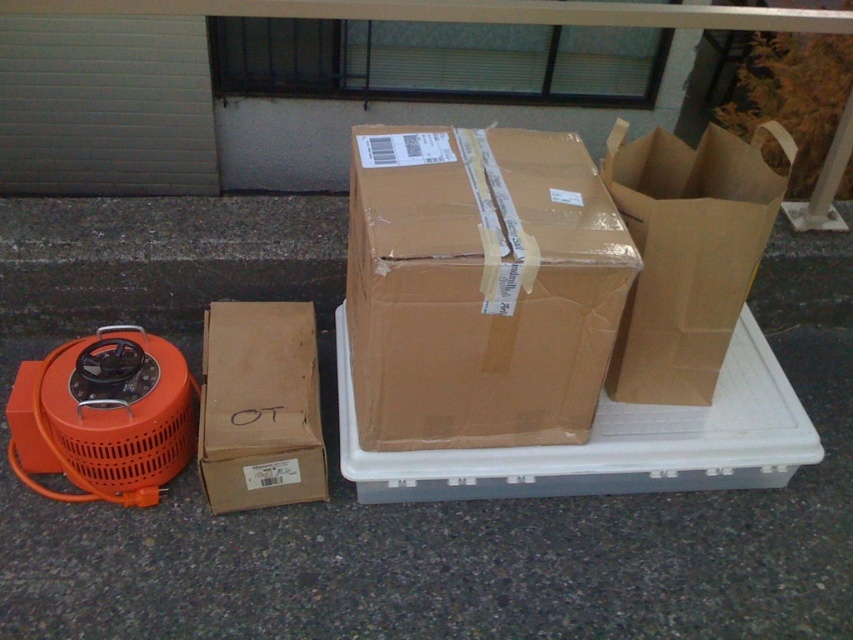
Question: Among these points, which one is nearest to the camera?

Choices:
 (A) (326, 486)
 (B) (606, 148)
 (C) (442, 196)

Answer: (C)

Question: Does brown cardboard box at center appear on the right side of brown cardboard box at lower left?

Choices:
 (A) yes
 (B) no

Answer: (A)

Question: Which object appears farthest from the camera in this image?

Choices:
 (A) brown cardboard box at center
 (B) brown cardboard box at lower left

Answer: (B)

Question: Can you confirm if brown cardboard box at center is positioned above brown cardboard box at lower left?

Choices:
 (A) yes
 (B) no

Answer: (A)

Question: Which point is farther to the camera?

Choices:
 (A) (233, 321)
 (B) (453, 346)

Answer: (A)

Question: Is brown cardboard box at center below brown paper bag at upper right?

Choices:
 (A) no
 (B) yes

Answer: (B)